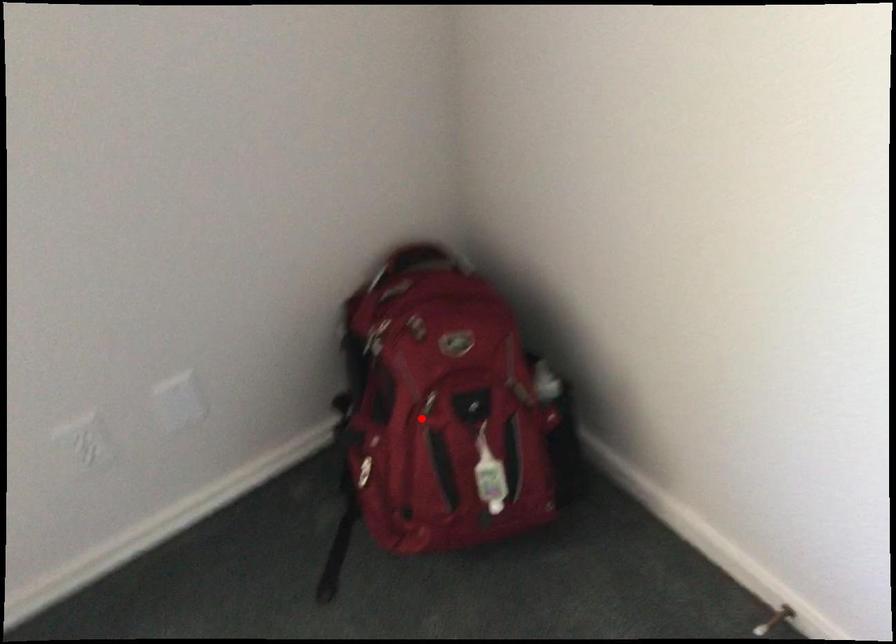
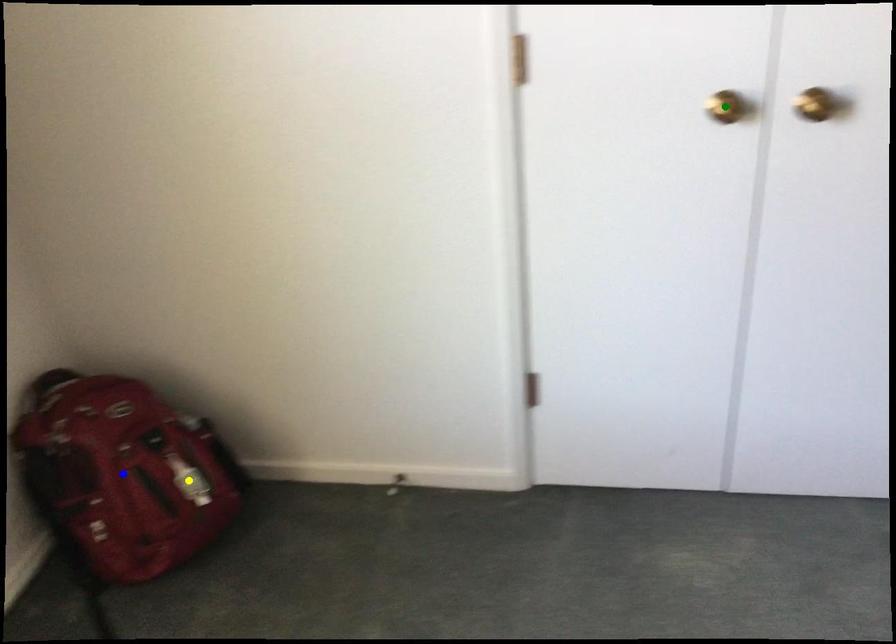
Question: I am providing you with two images of the same scene from different viewpoints. A red point is marked on the first image. You are given multiple points on the second image. Which point in image 2 is actually the same real-world point as the red point in image 1?

Choices:
 (A) blue point
 (B) green point
 (C) yellow point

Answer: (A)